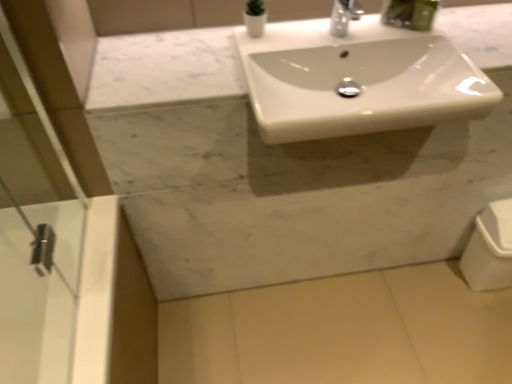
The height and width of the screenshot is (384, 512). I want to click on blank space to the left of white glossy trash can at lower right, so click(x=436, y=288).